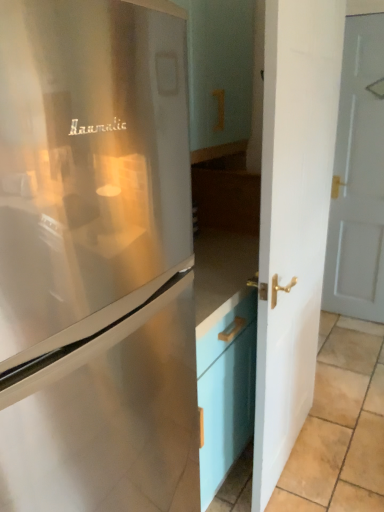
Question: Is beige tile at lower right oriented towards satin silver refrigerator at left?

Choices:
 (A) yes
 (B) no

Answer: (B)

Question: Is beige tile at lower right bigger than satin silver refrigerator at left?

Choices:
 (A) yes
 (B) no

Answer: (B)

Question: Can you confirm if beige tile at lower right is wider than satin silver refrigerator at left?

Choices:
 (A) no
 (B) yes

Answer: (B)

Question: Is beige tile at lower right looking in the opposite direction of satin silver refrigerator at left?

Choices:
 (A) no
 (B) yes

Answer: (A)

Question: Does beige tile at lower right contain satin silver refrigerator at left?

Choices:
 (A) yes
 (B) no

Answer: (B)

Question: From their relative heights in the image, would you say beige tile at lower right is taller or shorter than satin silver refrigerator at left?

Choices:
 (A) tall
 (B) short

Answer: (B)

Question: In terms of width, does beige tile at lower right look wider or thinner when compared to satin silver refrigerator at left?

Choices:
 (A) wide
 (B) thin

Answer: (A)

Question: Would you say beige tile at lower right is inside or outside satin silver refrigerator at left?

Choices:
 (A) outside
 (B) inside

Answer: (A)

Question: In terms of size, does beige tile at lower right appear bigger or smaller than satin silver refrigerator at left?

Choices:
 (A) big
 (B) small

Answer: (B)

Question: Looking at their shapes, would you say white glossy door at center, which appears as the first door when viewed from the left, is wider or thinner than satin silver refrigerator at left?

Choices:
 (A) thin
 (B) wide

Answer: (A)

Question: Considering the positions of white glossy door at center, the 1th door in the front-to-back sequence, and satin silver refrigerator at left in the image, is white glossy door at center, the 1th door in the front-to-back sequence, taller or shorter than satin silver refrigerator at left?

Choices:
 (A) short
 (B) tall

Answer: (B)

Question: Based on their positions, is white glossy door at center, the 1th door in the front-to-back sequence, located to the left or right of satin silver refrigerator at left?

Choices:
 (A) left
 (B) right

Answer: (B)

Question: Relative to satin silver refrigerator at left, is white glossy door at center, which appears as the first door when viewed from the left, in front or behind?

Choices:
 (A) front
 (B) behind

Answer: (B)

Question: Would you say satin silver refrigerator at left is to the left or to the right of beige tile at lower right in the picture?

Choices:
 (A) left
 (B) right

Answer: (A)

Question: Considering the positions of point (170, 370) and point (329, 377), is point (170, 370) closer or farther from the camera than point (329, 377)?

Choices:
 (A) closer
 (B) farther

Answer: (A)